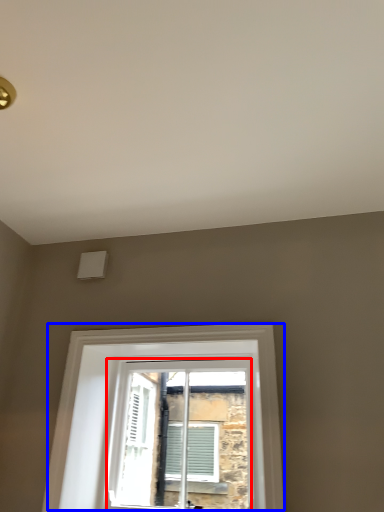
Question: Which object appears closest to the camera in this image, window (highlighted by a red box) or window (highlighted by a blue box)?

Choices:
 (A) window
 (B) window

Answer: (B)